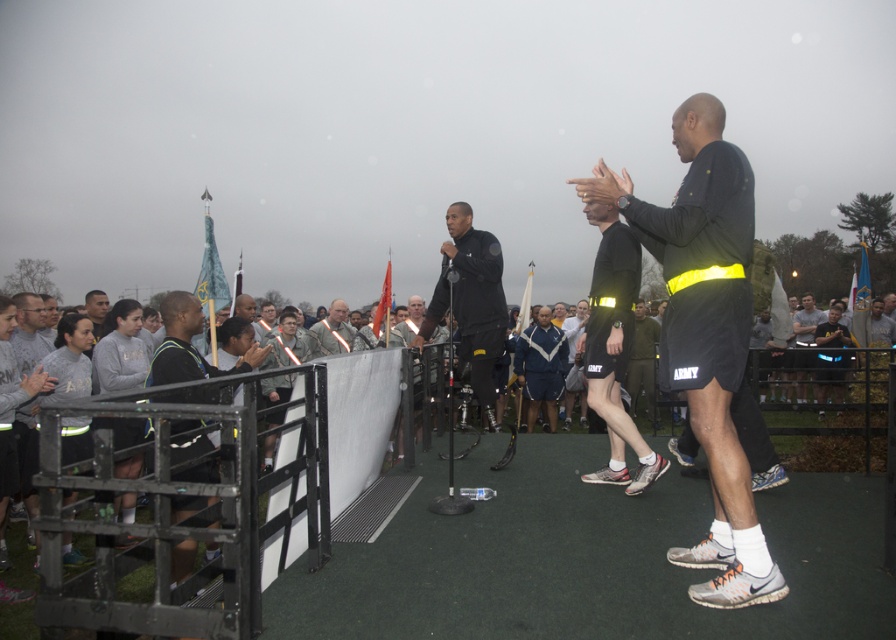
Question: Considering the real-world distances, which object is closest to the matte black microphone at center?

Choices:
 (A) reflective black shorts at center
 (B) black athletic wear at left
 (C) army uniform at center
 (D) black matte shorts at center

Answer: (A)

Question: Is black athletic wear at left further to camera compared to black matte microphone at center?

Choices:
 (A) yes
 (B) no

Answer: (B)

Question: Which point is farther from the camera taking this photo?

Choices:
 (A) (158, 380)
 (B) (670, 280)
 (C) (409, 320)
 (D) (468, 330)

Answer: (C)

Question: Does matte black microphone at center come behind black matte microphone at center?

Choices:
 (A) yes
 (B) no

Answer: (B)

Question: From the image, what is the correct spatial relationship of black athletic wear at left in relation to gray fabric shirt at left?

Choices:
 (A) right
 (B) left

Answer: (A)

Question: Which is nearer to the black athletic wear at left?

Choices:
 (A) black matte shorts at center
 (B) army uniform at center
 (C) reflective black shorts at center

Answer: (A)